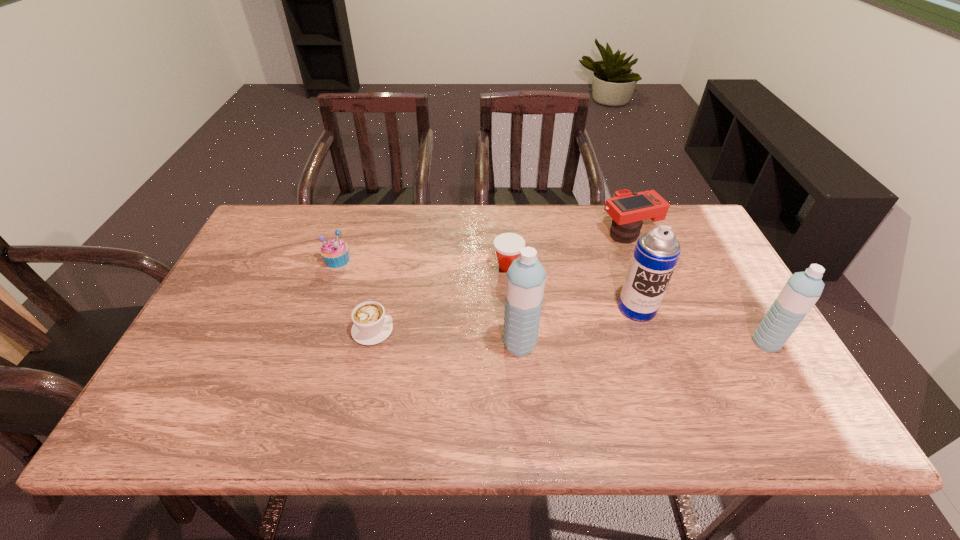
Where is `free space between the camera and the leftmost object`? The height and width of the screenshot is (540, 960). free space between the camera and the leftmost object is located at coordinates (483, 247).

Locate an element on the screen. free space between the leftmost object and the taller water bottle is located at coordinates (428, 302).

You are a GUI agent. You are given a task and a screenshot of the screen. Output one action in this format:
    pyautogui.click(x=<x>, y=<y>)
    Task: Click on the empty space that is in between the right water bottle and the aerosol can
    This screenshot has height=540, width=960.
    Given the screenshot: What is the action you would take?
    pyautogui.click(x=702, y=326)

Identify the location of empty location between the muffin and the shorter water bottle. This screenshot has height=540, width=960. (551, 301).

Image resolution: width=960 pixels, height=540 pixels. Identify the location of vacant space that's between the fourth tallest object and the Dixie cup. (568, 250).

Where is `the third closest object to the shortest object`? the third closest object to the shortest object is located at coordinates (507, 245).

Identify which object is located as the third nearest to the camera. Please provide its 2D coordinates. Your answer should be formatted as a tuple, i.e. [(x, y)], where the tuple contains the x and y coordinates of a point satisfying the conditions above.

[(802, 290)]

This screenshot has width=960, height=540. In order to click on vacant space that satisfies the following two spatial constraints: 1. to the right of the shorter water bottle's handle; 2. on the right side of the second object from left to right in this screenshot , I will do `click(371, 343)`.

You are a GUI agent. You are given a task and a screenshot of the screen. Output one action in this format:
    pyautogui.click(x=<x>, y=<y>)
    Task: Click on the free space that satisfies the following two spatial constraints: 1. on the back side of the shorter water bottle; 2. on the left side of the taller water bottle
    
    Given the screenshot: What is the action you would take?
    pyautogui.click(x=519, y=343)

This screenshot has height=540, width=960. Find the location of `vacant space that satisfies the following two spatial constraints: 1. on the back side of the left water bottle; 2. to the right of the cappuccino's handle`. vacant space that satisfies the following two spatial constraints: 1. on the back side of the left water bottle; 2. to the right of the cappuccino's handle is located at coordinates [518, 330].